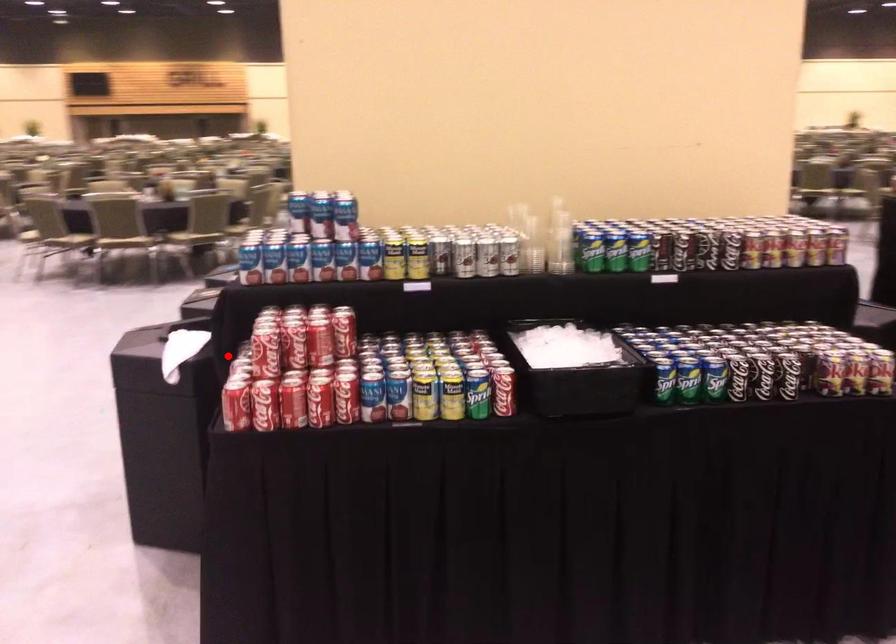
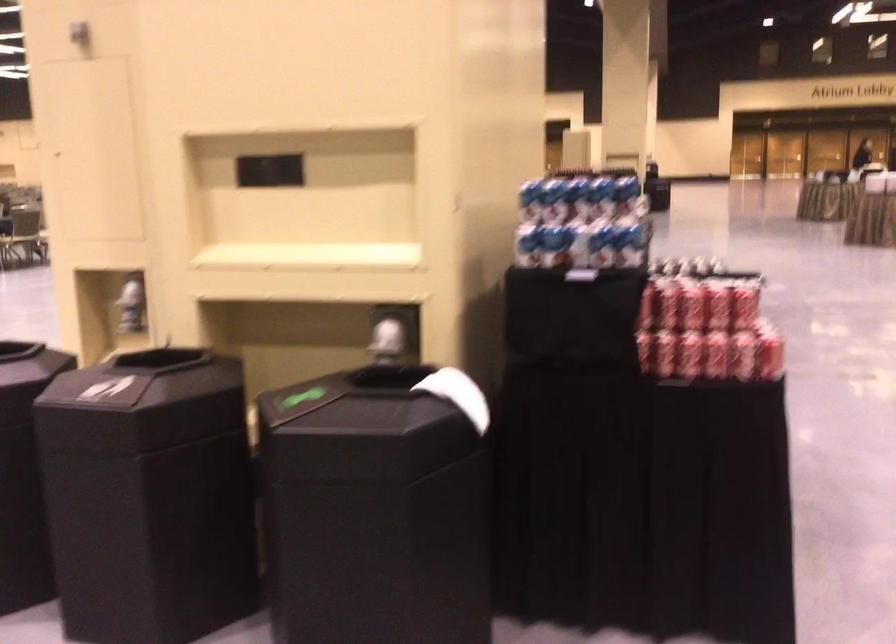
Question: I am providing you with two images of the same scene from different viewpoints. A red point is marked on the first image. Can you still see the location of the red point in image 2?

Choices:
 (A) Yes
 (B) No

Answer: (A)